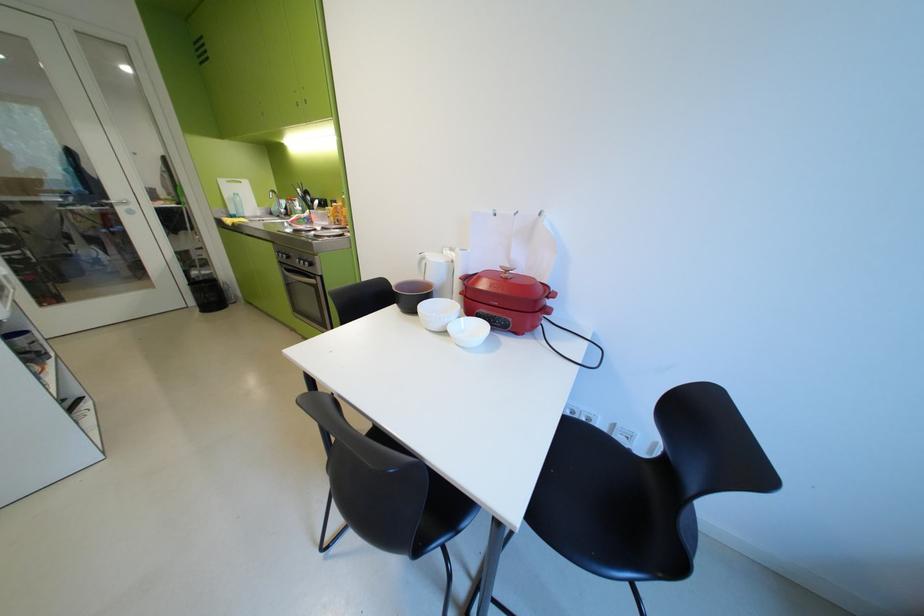
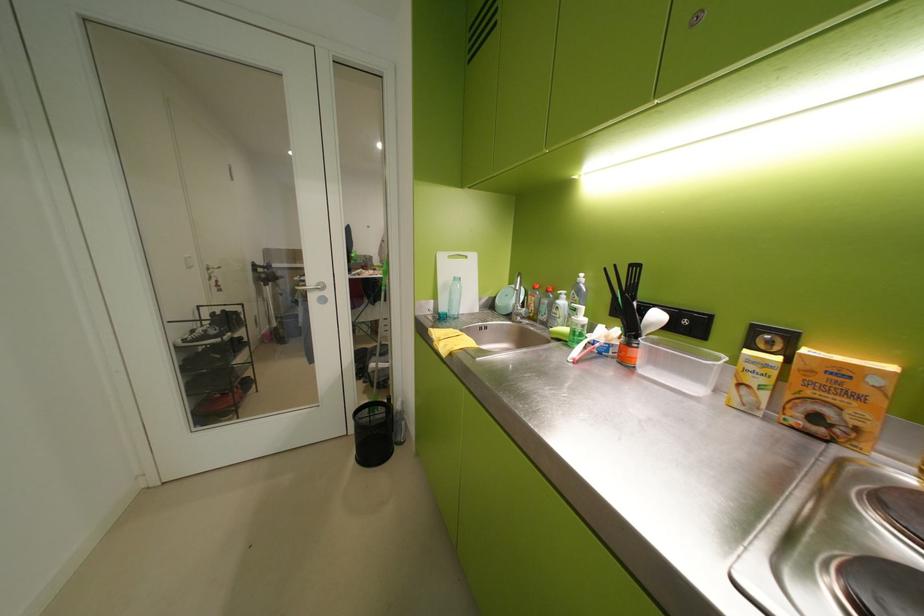
The point at (x=233, y=183) is marked in the first image. Where is the corresponding point in the second image?

(453, 259)